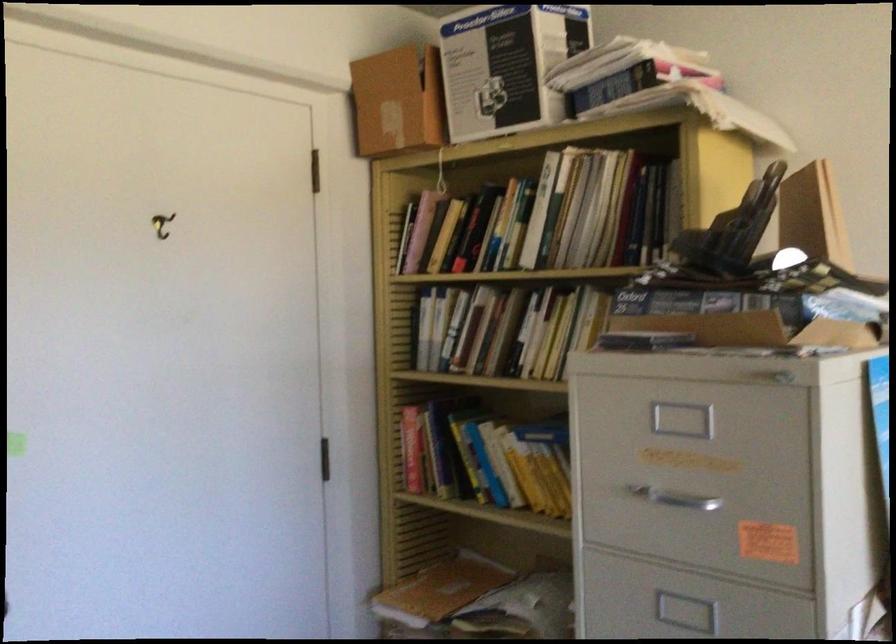
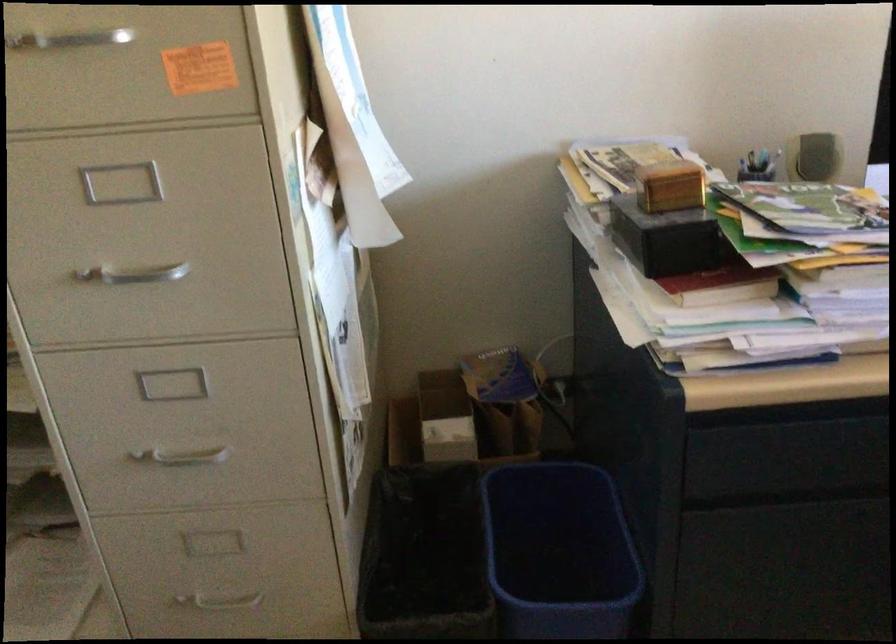
Locate, in the second image, the point that corresponds to point 672,504 in the first image.

(67, 40)